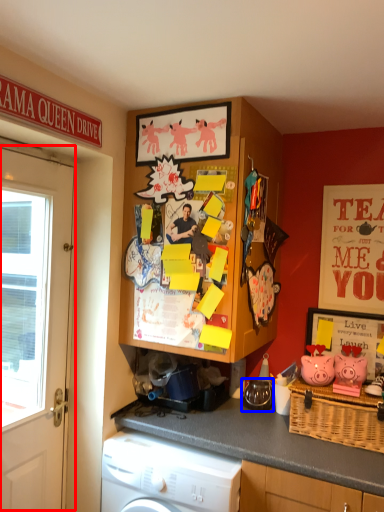
Question: Which point is closer to the camera, door (highlighted by a red box) or appliance (highlighted by a blue box)?

Choices:
 (A) door
 (B) appliance

Answer: (A)